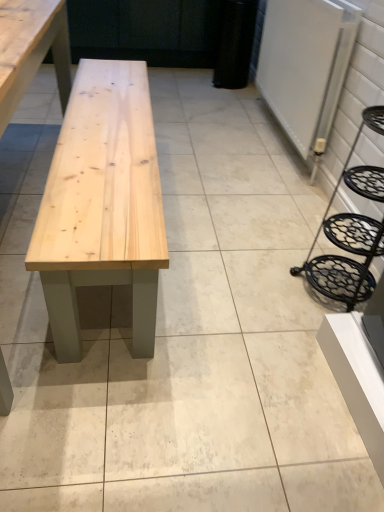
The width and height of the screenshot is (384, 512). Find the location of `black wrought iron step stool at right`. black wrought iron step stool at right is located at coordinates (x=351, y=231).

Image resolution: width=384 pixels, height=512 pixels. Describe the element at coordinates (351, 231) in the screenshot. I see `black wrought iron step stool at right` at that location.

Locate an element on the screen. black wrought iron step stool at right is located at coordinates (351, 231).